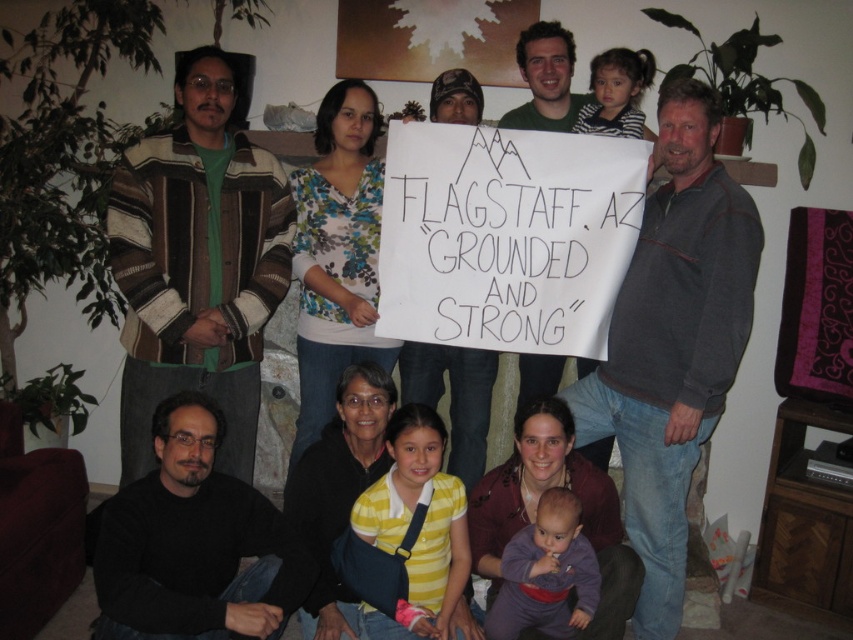
Question: Is striped wool sweater at left to the left of gray fleece sweater at right from the viewer's perspective?

Choices:
 (A) yes
 (B) no

Answer: (A)

Question: Among these objects, which one is nearest to the camera?

Choices:
 (A) gray fleece sweater at right
 (B) black matte shirt at lower left
 (C) yellow striped shirt at center
 (D) purple fleece baby at lower center

Answer: (B)

Question: Which is nearer to the yellow striped shirt at center?

Choices:
 (A) striped wool sweater at left
 (B) black matte shirt at lower left
 (C) purple soft baby at lower center

Answer: (C)

Question: Is striped wool sweater at left positioned before purple soft baby at lower center?

Choices:
 (A) no
 (B) yes

Answer: (A)

Question: Considering the relative positions of striped wool sweater at left and gray fleece sweater at right in the image provided, where is striped wool sweater at left located with respect to gray fleece sweater at right?

Choices:
 (A) above
 (B) below

Answer: (A)

Question: Which object is closer to the camera taking this photo?

Choices:
 (A) yellow striped shirt at center
 (B) purple fleece baby at lower center
 (C) gray fleece sweater at right
 (D) striped wool sweater at left

Answer: (C)